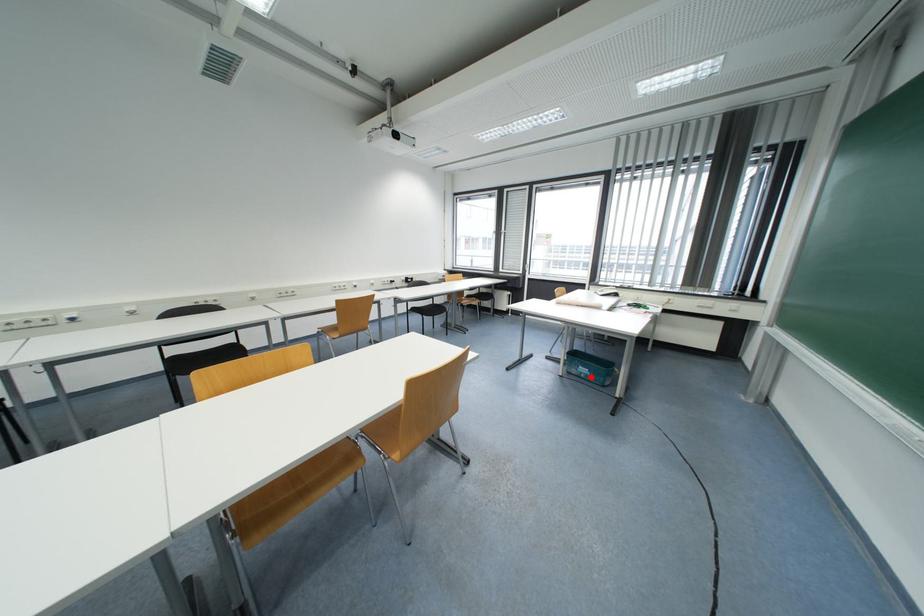
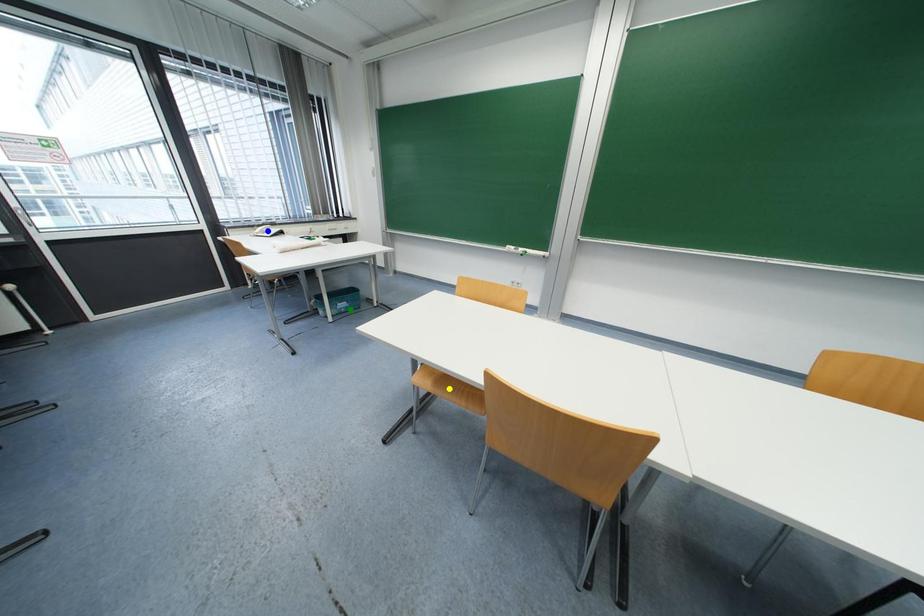
Question: I am providing you with two images of the same scene from different viewpoints. A red point is marked on the first image. You are given multiple points on the second image. Can you choose the point in image 2 that corresponds to the point in image 1?

Choices:
 (A) green point
 (B) blue point
 (C) yellow point

Answer: (A)